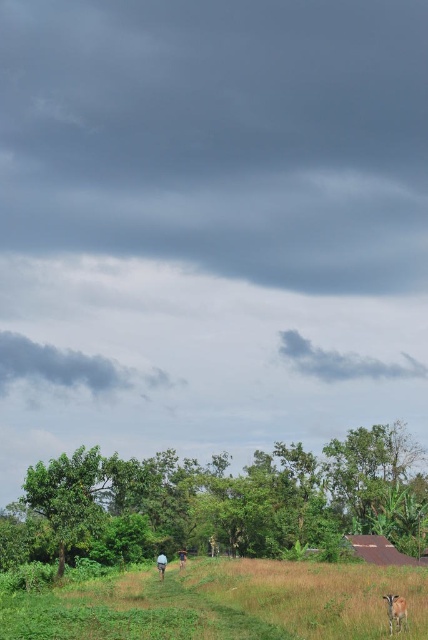
Question: Which of the following is the closest to the observer?

Choices:
 (A) blue fabric person at center
 (B) brown fur goat at lower right
 (C) blue fabric person at lower center

Answer: (B)

Question: Can you confirm if green leafy tree at lower center is bigger than blue fabric person at lower center?

Choices:
 (A) no
 (B) yes

Answer: (B)

Question: Does green leafy tree at lower center have a smaller size compared to green grassy pasture at lower center?

Choices:
 (A) no
 (B) yes

Answer: (A)

Question: Which point appears farthest from the camera in this image?

Choices:
 (A) (181, 561)
 (B) (386, 604)

Answer: (A)

Question: Does green grassy pasture at lower center appear over blue fabric person at lower center?

Choices:
 (A) yes
 (B) no

Answer: (A)

Question: Which of the following is the closest to the observer?

Choices:
 (A) brown fur goat at lower right
 (B) green leafy tree at lower center
 (C) blue fabric person at lower center

Answer: (A)